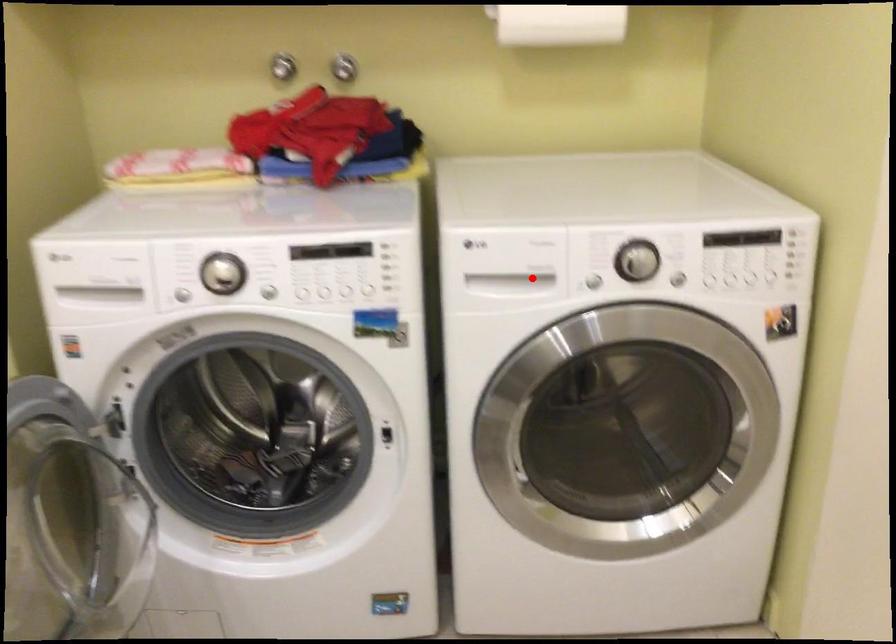
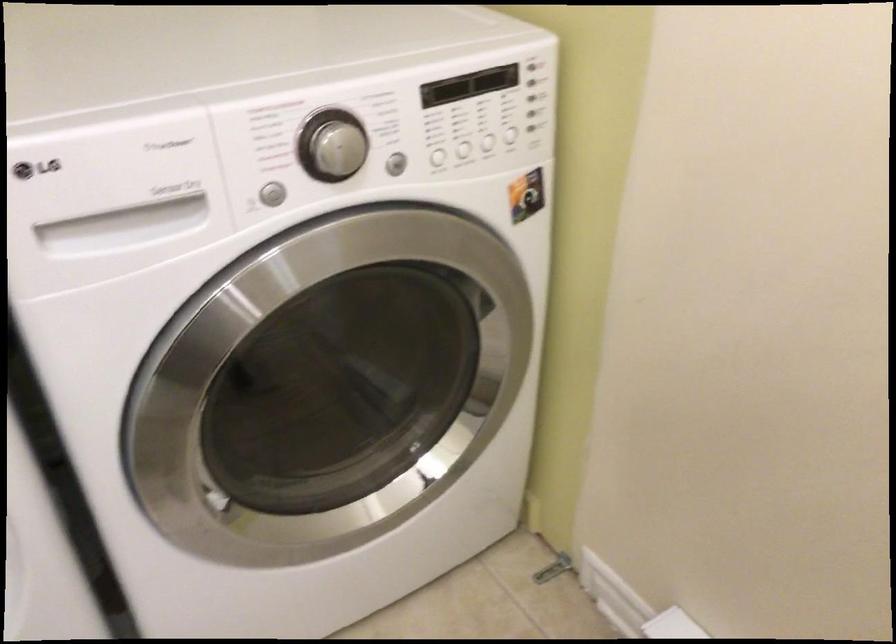
The point at the highlighted location is marked in the first image. Where is the corresponding point in the second image?

(164, 210)